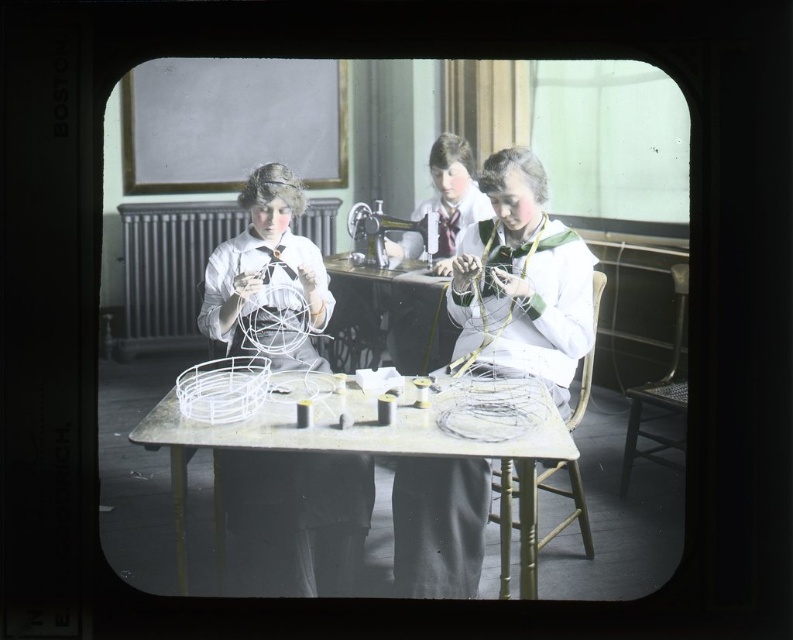
From the picture: Measure the distance between white wire basket at center and camera.

white wire basket at center and camera are 5.37 feet apart from each other.

Can you confirm if white wire basket at center is positioned to the right of metallic silver sewing machine at center?

Incorrect, white wire basket at center is not on the right side of metallic silver sewing machine at center.

I want to click on white wire basket at center, so click(x=361, y=449).

Where is `white wire basket at center`? The width and height of the screenshot is (793, 640). white wire basket at center is located at coordinates (361, 449).

Does white matte wire basket at center lie behind white fabric dress at center?

No, it is in front of white fabric dress at center.

Does white matte wire basket at center have a greater width compared to white fabric dress at center?

Yes.

Is point (272, 260) positioned in front of point (469, 216)?

No, it is not.

At what (x,y) coordinates should I click in order to perform the action: click on white matte wire basket at center. Please return your answer as a coordinate pair (x, y). Looking at the image, I should click on (293, 520).

Is point (332, 291) positioned before point (447, 266)?

Yes, point (332, 291) is closer to viewer.

The image size is (793, 640). What do you see at coordinates (393, 314) in the screenshot?
I see `white wire mesh table at center` at bounding box center [393, 314].

Where is `white wire mesh table at center`? white wire mesh table at center is located at coordinates (393, 314).